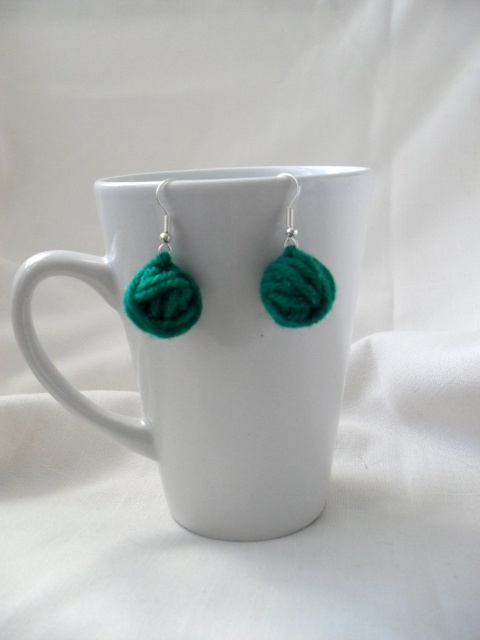
This screenshot has height=640, width=480. Identify the location of white ceramic mug at center. 223,339.

Between white ceramic mug at center and green yarn ball at left, which one is positioned lower?

Positioned lower is white ceramic mug at center.

Which is in front, point (216, 528) or point (175, 282)?

Point (175, 282) is more forward.

You are a GUI agent. You are given a task and a screenshot of the screen. Output one action in this format:
    pyautogui.click(x=<x>, y=<y>)
    Task: Click on the white ceramic mug at center
    
    Given the screenshot: What is the action you would take?
    pyautogui.click(x=223, y=339)

Can you confirm if white ceramic mug at center is shorter than green yarn ball at center?

Incorrect, white ceramic mug at center's height does not fall short of green yarn ball at center's.

Is white ceramic mug at center to the left of green yarn ball at center from the viewer's perspective?

Correct, you'll find white ceramic mug at center to the left of green yarn ball at center.

You are a GUI agent. You are given a task and a screenshot of the screen. Output one action in this format:
    pyautogui.click(x=<x>, y=<y>)
    Task: Click on the white ceramic mug at center
    
    Given the screenshot: What is the action you would take?
    pyautogui.click(x=223, y=339)

Does green yarn ball at left have a greater height compared to green yarn ball at center?

Indeed, green yarn ball at left has a greater height compared to green yarn ball at center.

Who is more forward, (132, 301) or (267, 298)?

Point (132, 301) is in front.

Measure the distance between point (192, 314) and camera.

Point (192, 314) and camera are 38.46 inches apart.

Find the location of `green yarn ball at left`. green yarn ball at left is located at coordinates (163, 291).